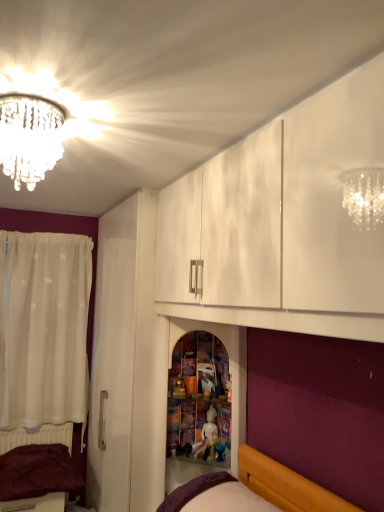
In order to face wooden shelf at center, should I rotate leftwards or rightwards?

You should look right and rotate roughly 0.882 degrees.

Measure the distance between wooden shelf at center and camera.

The depth of wooden shelf at center is 2.29 meters.

Identify the location of purple fabric bed at lower center, arranged as the first bed when viewed from the front. (256, 489).

This screenshot has width=384, height=512. Find the location of `purple fabric bed at lower left, placed as the first bed when sorted from left to right`. purple fabric bed at lower left, placed as the first bed when sorted from left to right is located at coordinates (79, 463).

Which of these two, purple fabric bed at lower left, the second bed positioned from the right, or purple fabric bed at lower center, which ranks as the 2th bed in back-to-front order, stands taller?

purple fabric bed at lower left, the second bed positioned from the right, is taller.

Is purple fabric bed at lower left, the first bed in the bottom-to-top sequence, turned away from purple fabric bed at lower center, which is the 2th bed from bottom to top?

No, purple fabric bed at lower left, the first bed in the bottom-to-top sequence, is not facing the opposite direction of purple fabric bed at lower center, which is the 2th bed from bottom to top.

From the image's perspective, is purple fabric bed at lower left, which is the second bed in top-to-bottom order, under purple fabric bed at lower center, arranged as the first bed when viewed from the front?

Yes, from the image's perspective, purple fabric bed at lower left, which is the second bed in top-to-bottom order, is beneath purple fabric bed at lower center, arranged as the first bed when viewed from the front.

How many degrees apart are the facing directions of purple fabric bed at lower left, which is the second bed in top-to-bottom order, and purple fabric bed at lower center, the 2th bed viewed from the left?

89.1 degrees.

In the scene shown: Is white glossy statue at center positioned beyond the bounds of white sheer curtain at left?

white glossy statue at center lies outside white sheer curtain at left's area.

This screenshot has height=512, width=384. What are the coordinates of `toy in front of the white sheer curtain at left` in the screenshot? It's located at (207, 437).

Which object is thinner, white glossy statue at center or white sheer curtain at left?

white glossy statue at center.

Is white glossy statue at center looking in the opposite direction of white sheer curtain at left?

No.

Is white sheer curtain at left aimed at white glossy statue at center?

No.

Considering the positions of objects white sheer curtain at left and white glossy statue at center in the image provided, who is behind, white sheer curtain at left or white glossy statue at center?

white sheer curtain at left.

Consider the image. Between white sheer curtain at left and white glossy statue at center, which one appears on the left side from the viewer's perspective?

From the viewer's perspective, white sheer curtain at left appears more on the left side.

How distant is white sheer curtain at left from white glossy statue at center?

The distance of white sheer curtain at left from white glossy statue at center is 1.38 meters.

How different are the orientations of crystal chandelier at upper left and white sheer curtain at left in degrees?

The facing directions of crystal chandelier at upper left and white sheer curtain at left are 87.1 degrees apart.

From a real-world perspective, does crystal chandelier at upper left stand above white sheer curtain at left?

Yes, from a real-world perspective, crystal chandelier at upper left is above white sheer curtain at left.

From the image's perspective, who appears lower, crystal chandelier at upper left or white sheer curtain at left?

white sheer curtain at left.

Based on the photo, could you tell me if crystal chandelier at upper left is turned towards white sheer curtain at left?

No.

Which object is positioned more to the right, purple fabric bed at lower center, arranged as the first bed when viewed from the front, or purple fabric bed at lower left, positioned as the first bed in back-to-front order?

purple fabric bed at lower center, arranged as the first bed when viewed from the front, is more to the right.

Does purple fabric bed at lower center, which ranks as the 2th bed in back-to-front order, have a lesser width compared to purple fabric bed at lower left, which is the second bed in top-to-bottom order?

Incorrect, the width of purple fabric bed at lower center, which ranks as the 2th bed in back-to-front order, is not less than that of purple fabric bed at lower left, which is the second bed in top-to-bottom order.

Considering their positions, is purple fabric bed at lower center, which ranks as the first bed in top-to-bottom order, located in front of or behind purple fabric bed at lower left, placed as the first bed when sorted from left to right?

purple fabric bed at lower center, which ranks as the first bed in top-to-bottom order, is in front of purple fabric bed at lower left, placed as the first bed when sorted from left to right.

Would you say purple fabric bed at lower center, which is the 2th bed from bottom to top, is inside or outside white sheer curtain at left?

purple fabric bed at lower center, which is the 2th bed from bottom to top, is not inside white sheer curtain at left, it's outside.

In terms of size, does purple fabric bed at lower center, which ranks as the 2th bed in back-to-front order, appear bigger or smaller than white sheer curtain at left?

Considering their sizes, purple fabric bed at lower center, which ranks as the 2th bed in back-to-front order, takes up less space than white sheer curtain at left.

Is purple fabric bed at lower center, the 2th bed viewed from the left, further to camera compared to white sheer curtain at left?

No.

Which is farther, (183, 425) or (198, 453)?

The point (183, 425) is behind.

Which of these two, wooden shelf at center or white glossy statue at center, is thinner?

With smaller width is white glossy statue at center.

Based on the photo, considering the relative positions of wooden shelf at center and white glossy statue at center in the image provided, is wooden shelf at center in front of white glossy statue at center?

Yes, wooden shelf at center is closer to the viewer.

The width and height of the screenshot is (384, 512). I want to click on bed in front of the purple fabric bed at lower left, the first bed in the bottom-to-top sequence, so click(x=256, y=489).

The image size is (384, 512). Find the location of `curtain located above the white glossy statue at center (from a real-world perspective)`. curtain located above the white glossy statue at center (from a real-world perspective) is located at coordinates (44, 328).

Which object lies nearer to the anchor point wooden shelf at center, white sheer curtain at left or white glossy statue at center?

white glossy statue at center lies closer to wooden shelf at center than the other object.

From the image, which object appears to be nearer to wooden shelf at center, purple fabric bed at lower left, which is the second bed in top-to-bottom order, or purple fabric bed at lower center, which ranks as the first bed in top-to-bottom order?

purple fabric bed at lower center, which ranks as the first bed in top-to-bottom order, lies closer to wooden shelf at center than the other object.

Considering their positions, is white sheer curtain at left positioned closer to wooden shelf at center than purple fabric bed at lower center, which ranks as the 2th bed in back-to-front order?

Based on the image, purple fabric bed at lower center, which ranks as the 2th bed in back-to-front order, appears to be nearer to wooden shelf at center.

Based on their spatial positions, is purple fabric bed at lower left, which is the second bed from front to back, or white glossy statue at center closer to wooden shelf at center?

white glossy statue at center lies closer to wooden shelf at center than the other object.

From the image, which object appears to be farther from crystal chandelier at upper left, purple fabric bed at lower left, placed as the first bed when sorted from left to right, or wooden shelf at center?

Based on the image, purple fabric bed at lower left, placed as the first bed when sorted from left to right, appears to be further to crystal chandelier at upper left.

Which object lies further to the anchor point purple fabric bed at lower left, which is the second bed in top-to-bottom order, purple fabric bed at lower center, which is the 2th bed from bottom to top, or white sheer curtain at left?

purple fabric bed at lower center, which is the 2th bed from bottom to top.

From the image, which object appears to be nearer to purple fabric bed at lower center, which appears as the 1th bed when viewed from the right, white sheer curtain at left or white glossy statue at center?

Based on the image, white glossy statue at center appears to be nearer to purple fabric bed at lower center, which appears as the 1th bed when viewed from the right.

Considering their positions, is purple fabric bed at lower center, the 2th bed viewed from the left, positioned further to white sheer curtain at left than wooden shelf at center?

Based on the image, purple fabric bed at lower center, the 2th bed viewed from the left, appears to be further to white sheer curtain at left.

Locate an element on the screen. The image size is (384, 512). bed located between white sheer curtain at left and wooden shelf at center in the left-right direction is located at coordinates (79, 463).

This screenshot has width=384, height=512. I want to click on toy between crystal chandelier at upper left and purple fabric bed at lower center, which ranks as the first bed in top-to-bottom order, in the vertical direction, so click(x=207, y=437).

Locate an element on the screen. toy between purple fabric bed at lower center, the 2th bed viewed from the left, and purple fabric bed at lower left, which is the second bed in top-to-bottom order, along the z-axis is located at coordinates (207, 437).

The image size is (384, 512). I want to click on shelf positioned between purple fabric bed at lower center, which ranks as the 2th bed in back-to-front order, and white glossy statue at center from near to far, so point(198,392).